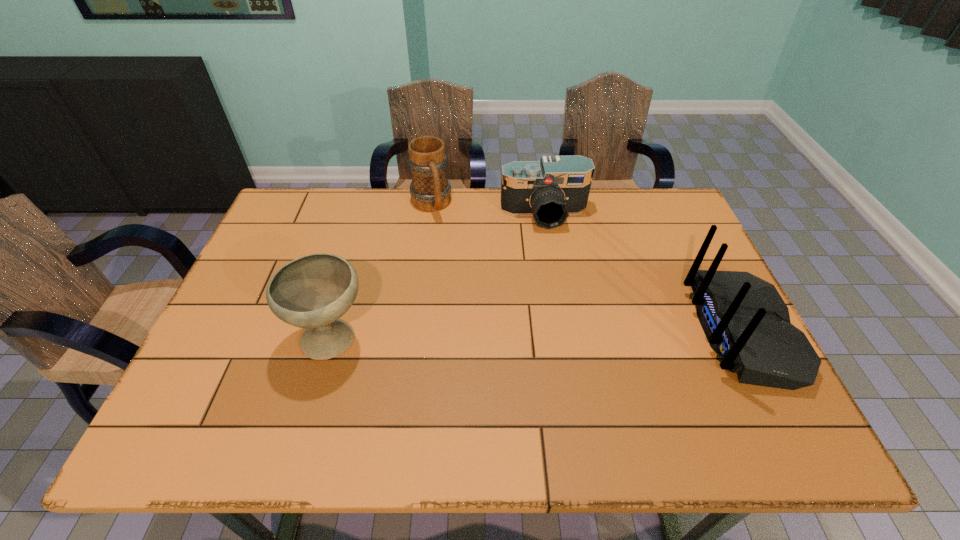
Image resolution: width=960 pixels, height=540 pixels. I want to click on the leftmost object, so click(312, 292).

Find the location of a particular element. The image size is (960, 540). router is located at coordinates (745, 320).

Identify the location of camera. This screenshot has height=540, width=960. (550, 190).

Identify the location of the shortest object. (550, 190).

The width and height of the screenshot is (960, 540). Find the location of `the second object from left to right`. the second object from left to right is located at coordinates (430, 190).

Where is `vacant position located 0.320m on the right of the leftmost object`? This screenshot has height=540, width=960. vacant position located 0.320m on the right of the leftmost object is located at coordinates (502, 339).

Find the location of a particular element. The width and height of the screenshot is (960, 540). free point located on the back of the rightmost object is located at coordinates (543, 331).

I want to click on vacant area located 0.230m on the back of the rightmost object, so click(x=603, y=331).

In order to click on free location located 0.370m on the back of the rightmost object in this screenshot , I will do pos(547,331).

At what (x,y) coordinates should I click in order to perform the action: click on vacant space located on the front-facing side of the camera. Please return your answer as a coordinate pair (x, y). Looking at the image, I should click on (550, 242).